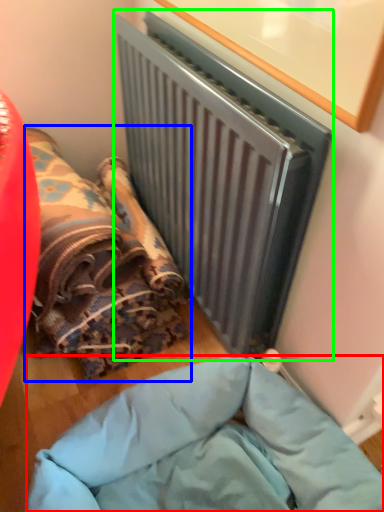
Question: Which object is positioned farthest from furniture (highlighted by a red box)? Select from bean bag chair (highlighted by a blue box) and radiator (highlighted by a green box).

Choices:
 (A) bean bag chair
 (B) radiator

Answer: (B)